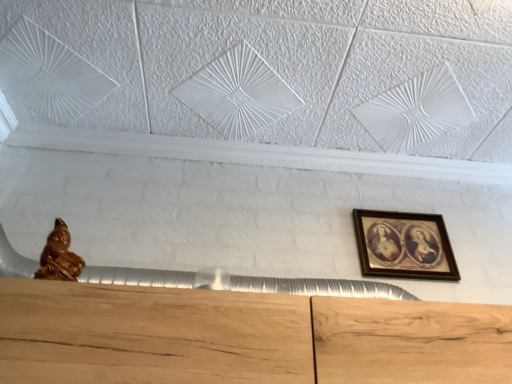
Question: Does wooden framed picture at upper right have a lesser height compared to gold polished statue at lower left?

Choices:
 (A) yes
 (B) no

Answer: (B)

Question: From the image's perspective, is wooden framed picture at upper right above gold polished statue at lower left?

Choices:
 (A) yes
 (B) no

Answer: (B)

Question: Is gold polished statue at lower left at the back of wooden framed picture at upper right?

Choices:
 (A) yes
 (B) no

Answer: (B)

Question: Is wooden framed picture at upper right oriented towards gold polished statue at lower left?

Choices:
 (A) no
 (B) yes

Answer: (A)

Question: Considering the relative positions of wooden framed picture at upper right and gold polished statue at lower left in the image provided, is wooden framed picture at upper right to the right of gold polished statue at lower left from the viewer's perspective?

Choices:
 (A) no
 (B) yes

Answer: (B)

Question: From a real-world perspective, is wooden framed picture at upper right located beneath gold polished statue at lower left?

Choices:
 (A) yes
 (B) no

Answer: (B)

Question: Considering the relative sizes of gold polished statue at lower left and wooden framed picture at upper right in the image provided, is gold polished statue at lower left taller than wooden framed picture at upper right?

Choices:
 (A) yes
 (B) no

Answer: (B)

Question: Would you say gold polished statue at lower left is outside wooden framed picture at upper right?

Choices:
 (A) no
 (B) yes

Answer: (B)

Question: From a real-world perspective, is gold polished statue at lower left positioned over wooden framed picture at upper right based on gravity?

Choices:
 (A) no
 (B) yes

Answer: (A)

Question: Considering the relative sizes of gold polished statue at lower left and wooden framed picture at upper right in the image provided, is gold polished statue at lower left wider than wooden framed picture at upper right?

Choices:
 (A) yes
 (B) no

Answer: (A)

Question: From the image's perspective, is gold polished statue at lower left under wooden framed picture at upper right?

Choices:
 (A) yes
 (B) no

Answer: (B)

Question: Is gold polished statue at lower left to the right of wooden framed picture at upper right from the viewer's perspective?

Choices:
 (A) no
 (B) yes

Answer: (A)

Question: Is point (54, 246) closer or farther from the camera than point (391, 238)?

Choices:
 (A) closer
 (B) farther

Answer: (A)